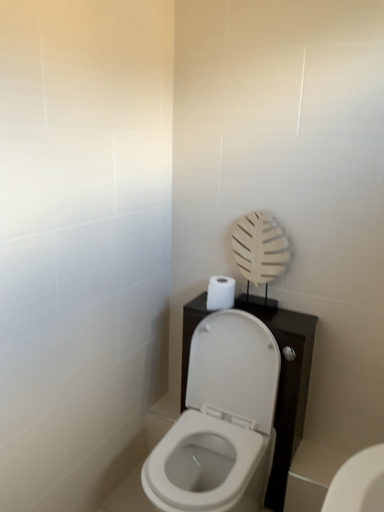
Question: Is white matte toilet paper at upper right smaller than white glossy toilet at lower right, positioned as the 2th toilet in left-to-right order?

Choices:
 (A) yes
 (B) no

Answer: (B)

Question: Is the depth of white matte toilet paper at upper right less than that of white glossy toilet at lower right, the first toilet when ordered from right to left?

Choices:
 (A) yes
 (B) no

Answer: (B)

Question: From the image's perspective, is white matte toilet paper at upper right beneath white glossy toilet at lower right, arranged as the first toilet when ordered from the bottom?

Choices:
 (A) no
 (B) yes

Answer: (A)

Question: From the image's perspective, is white matte toilet paper at upper right on top of white glossy toilet at lower right, arranged as the first toilet when ordered from the bottom?

Choices:
 (A) yes
 (B) no

Answer: (A)

Question: Can you confirm if white matte toilet paper at upper right is taller than white glossy toilet at lower right, arranged as the first toilet when ordered from the bottom?

Choices:
 (A) yes
 (B) no

Answer: (A)

Question: Is white matte toilet paper at upper right next to white glossy toilet at lower right, the first toilet when ordered from right to left?

Choices:
 (A) no
 (B) yes

Answer: (A)

Question: Is white matte toilet paper at upper right surrounded by white glossy toilet at center, positioned as the 2th toilet in right-to-left order?

Choices:
 (A) no
 (B) yes

Answer: (A)

Question: Does white glossy toilet at center, the second toilet positioned from the bottom, have a greater width compared to white matte toilet paper at upper right?

Choices:
 (A) yes
 (B) no

Answer: (A)

Question: Considering the relative sizes of white glossy toilet at center, positioned as the 2th toilet in right-to-left order, and white matte toilet paper at upper right in the image provided, is white glossy toilet at center, positioned as the 2th toilet in right-to-left order, thinner than white matte toilet paper at upper right?

Choices:
 (A) no
 (B) yes

Answer: (A)

Question: Does white glossy toilet at center, placed as the first toilet when sorted from top to bottom, appear on the right side of white matte toilet paper at upper right?

Choices:
 (A) no
 (B) yes

Answer: (A)

Question: Would you consider white glossy toilet at center, which ranks as the first toilet in left-to-right order, to be distant from white matte toilet paper at upper right?

Choices:
 (A) yes
 (B) no

Answer: (B)

Question: From the image's perspective, is white glossy toilet at center, placed as the first toilet when sorted from top to bottom, located beneath white matte toilet paper at upper right?

Choices:
 (A) no
 (B) yes

Answer: (B)

Question: Is white glossy toilet at lower right, arranged as the first toilet when ordered from the bottom, in contact with white matte toilet paper at upper right?

Choices:
 (A) no
 (B) yes

Answer: (A)